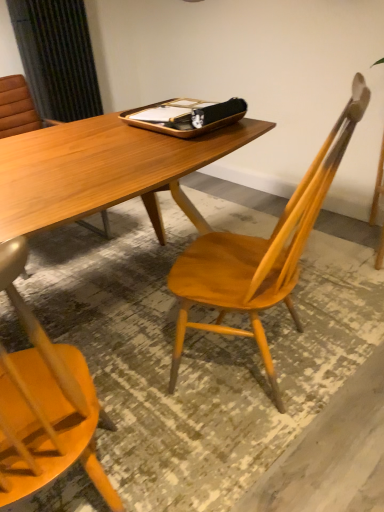
Image resolution: width=384 pixels, height=512 pixels. Describe the element at coordinates (260, 253) in the screenshot. I see `wooden chair at center` at that location.

Where is `wooden chair at center`? This screenshot has height=512, width=384. wooden chair at center is located at coordinates (260, 253).

This screenshot has width=384, height=512. Describe the element at coordinates (186, 116) in the screenshot. I see `wooden tray at center` at that location.

Where is `wooden tray at center`? The width and height of the screenshot is (384, 512). wooden tray at center is located at coordinates (186, 116).

Locate an element on the screen. This screenshot has height=512, width=384. wooden chair at center is located at coordinates (260, 253).

Between wooden tray at center and wooden chair at center, which one appears on the left side from the viewer's perspective?

wooden tray at center.

Does wooden tray at center lie in front of wooden chair at center?

No, it is not.

Which is behind, point (175, 117) or point (271, 244)?

Point (175, 117)

From the image's perspective, relative to wooden chair at center, is wooden tray at center above or below?

From the image's perspective, wooden tray at center appears above wooden chair at center.

From a real-world perspective, is wooden tray at center located higher than wooden chair at center?

Correct, in the physical world, wooden tray at center is higher than wooden chair at center.

Does wooden tray at center have a greater width compared to wooden chair at center?

Incorrect, the width of wooden tray at center does not surpass that of wooden chair at center.

Which of these two, wooden tray at center or wooden chair at center, stands shorter?

Answer: With less height is wooden tray at center.

Who is smaller, wooden tray at center or wooden chair at center?

wooden tray at center.

Is wooden chair at center inside wooden tray at center?

No.

Is wooden tray at center next to wooden chair at center and touching it?

There is a gap between wooden tray at center and wooden chair at center.

Is wooden tray at center oriented towards wooden chair at center?

Yes, wooden tray at center is oriented towards wooden chair at center.

What's the angular difference between wooden tray at center and wooden chair at center's facing directions?

The facing directions of wooden tray at center and wooden chair at center are 154 degrees apart.

The width and height of the screenshot is (384, 512). In order to click on tray that appears above the wooden chair at center (from a real-world perspective) in this screenshot , I will do `click(186, 116)`.

Can you confirm if wooden chair at center is positioned to the right of wooden tray at center?

Yes, wooden chair at center is to the right of wooden tray at center.

Is the depth of wooden chair at center less than that of wooden tray at center?

That is True.

Between point (368, 98) and point (218, 121), which one is positioned behind?

The point (218, 121) is behind.

From the image's perspective, which one is positioned lower, wooden chair at center or wooden tray at center?

From the image's view, wooden chair at center is below.

From a real-world perspective, does wooden chair at center sit lower than wooden tray at center?

Yes.

Which object is wider, wooden chair at center or wooden tray at center?

Wider between the two is wooden chair at center.

Consider the image. Can you confirm if wooden chair at center is shorter than wooden tray at center?

In fact, wooden chair at center may be taller than wooden tray at center.

Between wooden chair at center and wooden tray at center, which one has smaller size?

Smaller between the two is wooden tray at center.

From the picture: Can wooden tray at center be found inside wooden chair at center?

Definitely not — wooden tray at center is not inside wooden chair at center.

Are wooden chair at center and wooden tray at center making contact?

No, wooden chair at center is not making contact with wooden tray at center.

Is wooden chair at center looking in the opposite direction of wooden tray at center?

No.

Locate an element on the screen. chair on the right of wooden tray at center is located at coordinates (260, 253).

You are a GUI agent. You are given a task and a screenshot of the screen. Output one action in this format:
    pyautogui.click(x=<x>, y=<y>)
    Task: Click on the tray above the wooden chair at center (from a real-world perspective)
    This screenshot has width=384, height=512.
    Given the screenshot: What is the action you would take?
    pyautogui.click(x=186, y=116)

Where is `chair lying below the wooden tray at center (from the image's perspective)`? The height and width of the screenshot is (512, 384). chair lying below the wooden tray at center (from the image's perspective) is located at coordinates (260, 253).